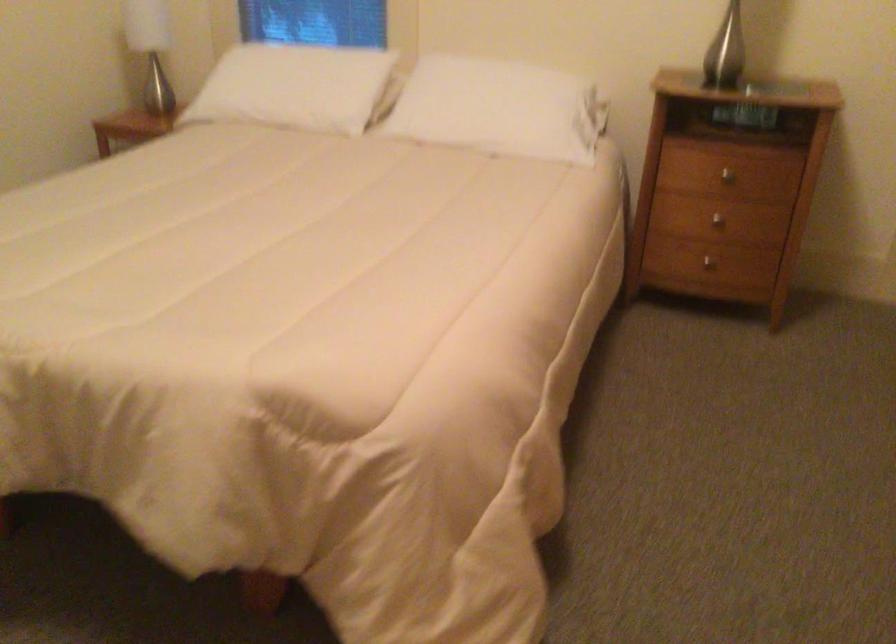
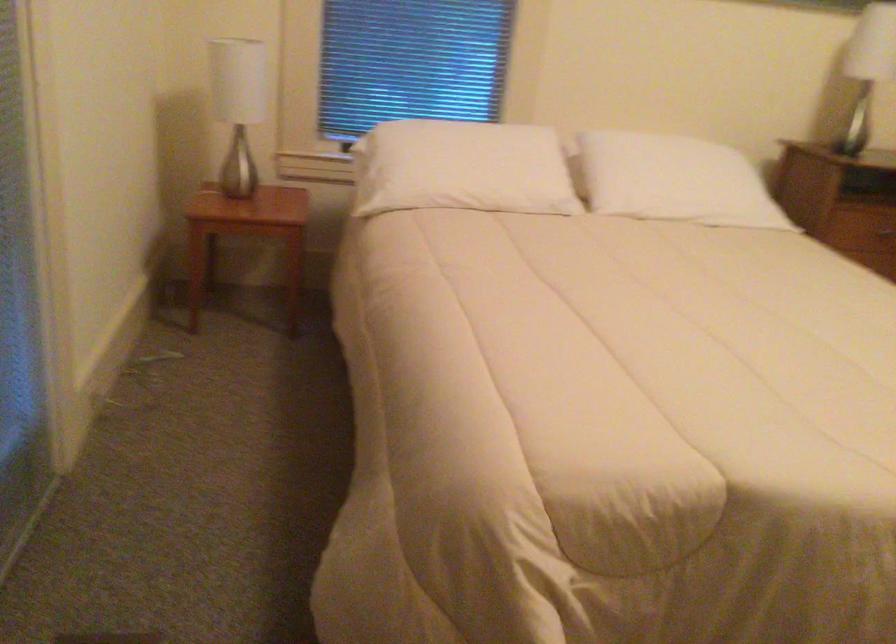
The point at (251, 88) is marked in the first image. Where is the corresponding point in the second image?

(462, 167)